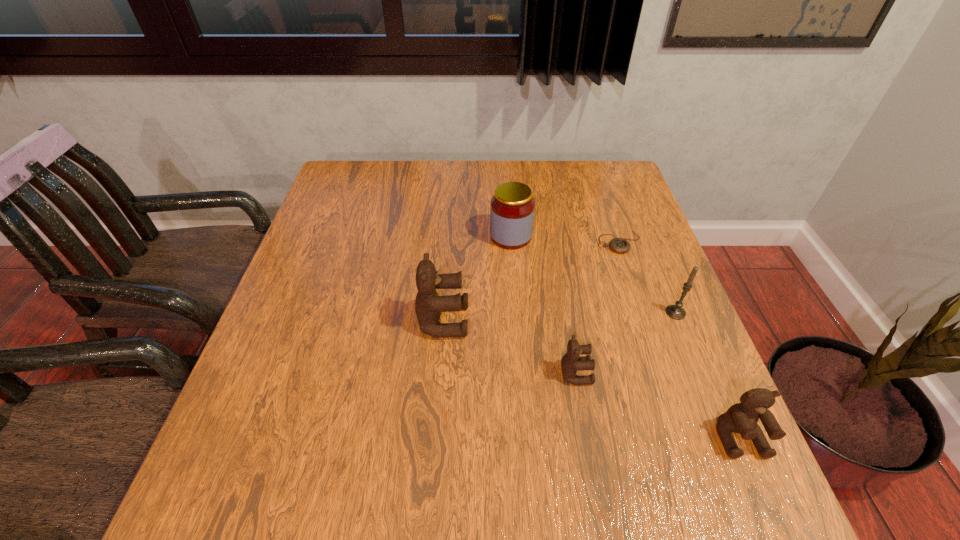
Image resolution: width=960 pixels, height=540 pixels. Find the location of `free space located on the face of the second nearest teddy bear`. free space located on the face of the second nearest teddy bear is located at coordinates (676, 373).

Locate an element on the screen. This screenshot has height=540, width=960. free space located on the right of the jar is located at coordinates (606, 237).

Find the location of a particular element. vacant space located on the left of the shortest object is located at coordinates (457, 242).

At what (x,y) coordinates should I click in order to perform the action: click on vacant space situated on the front of the candle. Please return your answer as a coordinate pair (x, y). The width and height of the screenshot is (960, 540). Looking at the image, I should click on (689, 346).

You are a GUI agent. You are given a task and a screenshot of the screen. Output one action in this format:
    pyautogui.click(x=<x>, y=<y>)
    Task: Click on the object present at the near edge
    The height and width of the screenshot is (540, 960).
    Given the screenshot: What is the action you would take?
    pyautogui.click(x=742, y=418)

Where is `teddy bear present at the right edge`? The width and height of the screenshot is (960, 540). teddy bear present at the right edge is located at coordinates (742, 418).

The width and height of the screenshot is (960, 540). In order to click on pocket watch positioned at the right edge in this screenshot , I will do `click(619, 245)`.

Locate an element on the screen. This screenshot has height=540, width=960. candle that is at the right edge is located at coordinates (676, 312).

Where is `object that is at the near right corner`? This screenshot has height=540, width=960. object that is at the near right corner is located at coordinates (742, 418).

You are a GUI agent. You are given a task and a screenshot of the screen. Output one action in this format:
    pyautogui.click(x=<x>, y=<y>)
    Task: Click on the free space at the far edge of the desktop
    The height and width of the screenshot is (540, 960).
    Given the screenshot: What is the action you would take?
    pyautogui.click(x=566, y=164)